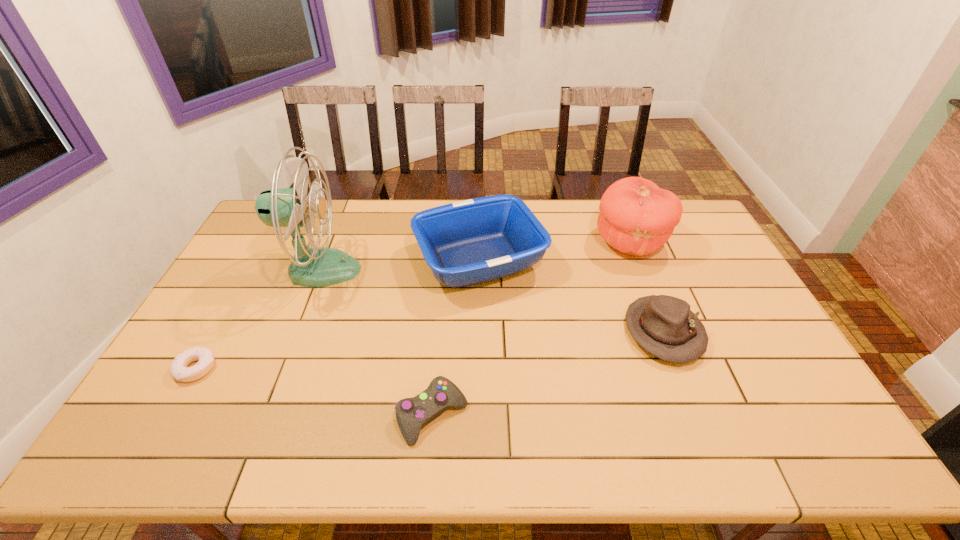
The image size is (960, 540). What are the coordinates of `blank region between the nearest object and the tallest object` in the screenshot? It's located at (376, 342).

Where is `the closest object relative to the fourth shortest object`? The image size is (960, 540). the closest object relative to the fourth shortest object is located at coordinates click(314, 266).

Select which object is the third closest to the tray. Please provide its 2D coordinates. Your answer should be formatted as a tuple, i.e. [(x, y)], where the tuple contains the x and y coordinates of a point satisfying the conditions above.

[(664, 326)]